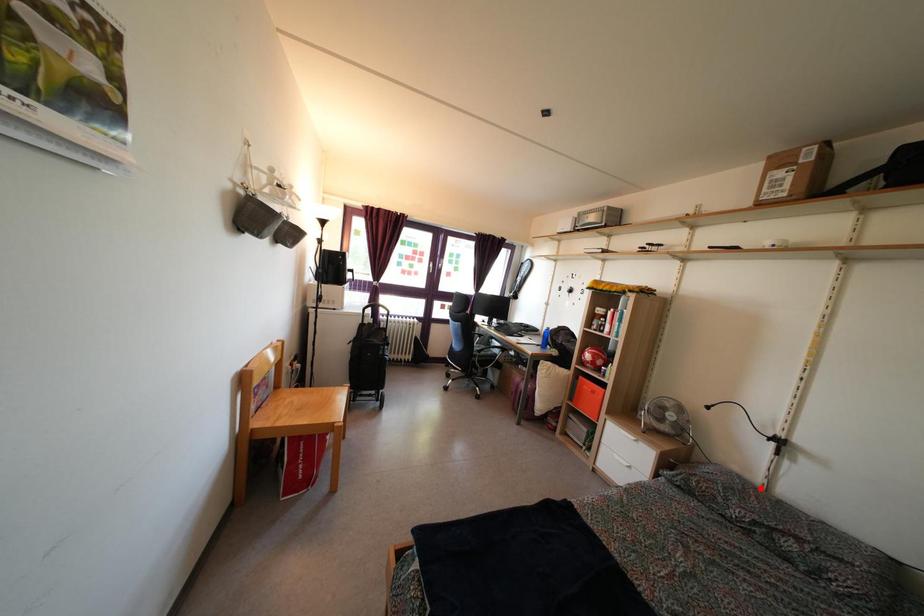
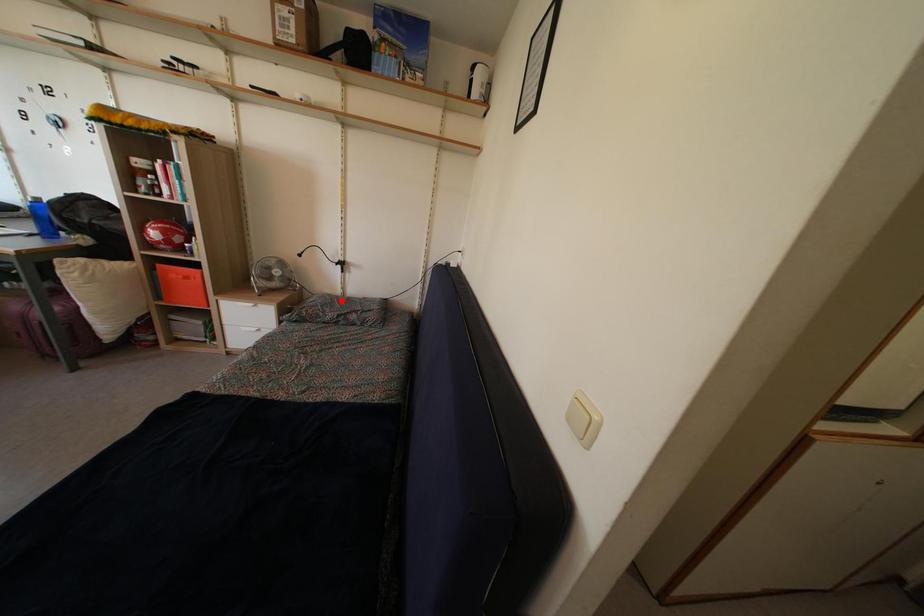
I am providing you with two images of the same scene from different viewpoints. A red point is marked on the first image and another point is marked on the second image. Is the red point in image1 aligned with the point shown in image2?

Yes